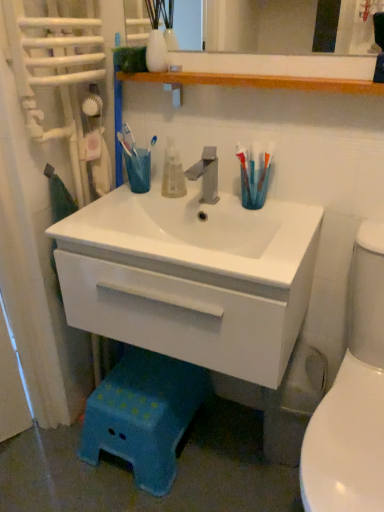
This screenshot has width=384, height=512. What are the coordinates of `vacant position to the left of translucent plastic mouthwash at center` in the screenshot? It's located at click(x=125, y=195).